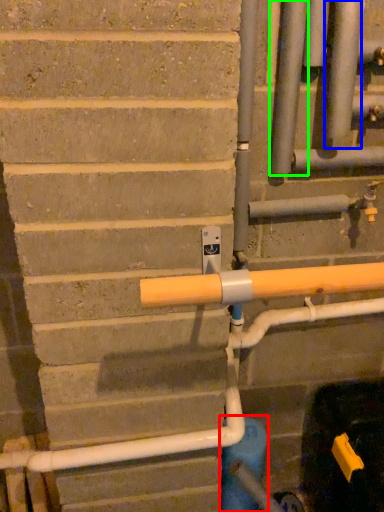
Question: Considering the real-world distances, which object is farthest from water pipe (highlighted by a red box)? pipe (highlighted by a blue box) or pipe (highlighted by a green box)?

Choices:
 (A) pipe
 (B) pipe

Answer: (A)